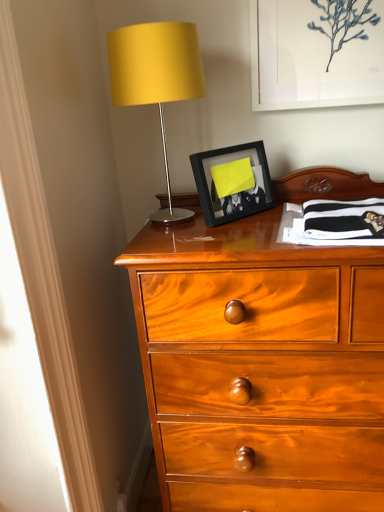
Question: Should I look upward or downward to see white matte picture frame at upper center, which is the second picture frame from left to right?

Choices:
 (A) down
 (B) up

Answer: (B)

Question: Is matte yellow fabric at upper left at the right side of white matte picture frame at upper center, acting as the 1th picture frame starting from the right?

Choices:
 (A) yes
 (B) no

Answer: (B)

Question: Can you confirm if matte yellow fabric at upper left is smaller than white matte picture frame at upper center, the first picture frame viewed from the top?

Choices:
 (A) yes
 (B) no

Answer: (B)

Question: Is matte yellow fabric at upper left facing away from white matte picture frame at upper center, arranged as the 2th picture frame when ordered from the bottom?

Choices:
 (A) yes
 (B) no

Answer: (B)

Question: Considering the relative sizes of matte yellow fabric at upper left and white matte picture frame at upper center, acting as the 1th picture frame starting from the right, in the image provided, is matte yellow fabric at upper left wider than white matte picture frame at upper center, acting as the 1th picture frame starting from the right,?

Choices:
 (A) yes
 (B) no

Answer: (A)

Question: From the image's perspective, is matte yellow fabric at upper left located beneath white matte picture frame at upper center, the first picture frame viewed from the top?

Choices:
 (A) no
 (B) yes

Answer: (B)

Question: Can you confirm if matte yellow fabric at upper left is thinner than white matte picture frame at upper center, the first picture frame viewed from the top?

Choices:
 (A) yes
 (B) no

Answer: (B)

Question: Is matte yellow fabric at upper left turned away from black matte picture frame at center, positioned as the 1th picture frame in bottom-to-top order?

Choices:
 (A) yes
 (B) no

Answer: (B)

Question: Is matte yellow fabric at upper left completely or partially outside of black matte picture frame at center, which is the 1th picture frame in left-to-right order?

Choices:
 (A) no
 (B) yes

Answer: (B)

Question: Considering the relative sizes of matte yellow fabric at upper left and black matte picture frame at center, which is the 1th picture frame in left-to-right order, in the image provided, is matte yellow fabric at upper left wider than black matte picture frame at center, which is the 1th picture frame in left-to-right order,?

Choices:
 (A) yes
 (B) no

Answer: (A)

Question: From the image's perspective, is matte yellow fabric at upper left over black matte picture frame at center, which is counted as the 2th picture frame, starting from the right?

Choices:
 (A) yes
 (B) no

Answer: (A)

Question: Is matte yellow fabric at upper left taller than black matte picture frame at center, positioned as the 1th picture frame in bottom-to-top order?

Choices:
 (A) yes
 (B) no

Answer: (A)

Question: Is matte yellow fabric at upper left to the left of black matte picture frame at center, positioned as the 1th picture frame in bottom-to-top order, from the viewer's perspective?

Choices:
 (A) yes
 (B) no

Answer: (A)

Question: Could you tell me if black matte picture frame at center, which is the 1th picture frame in left-to-right order, is facing matte yellow fabric at upper left?

Choices:
 (A) yes
 (B) no

Answer: (B)